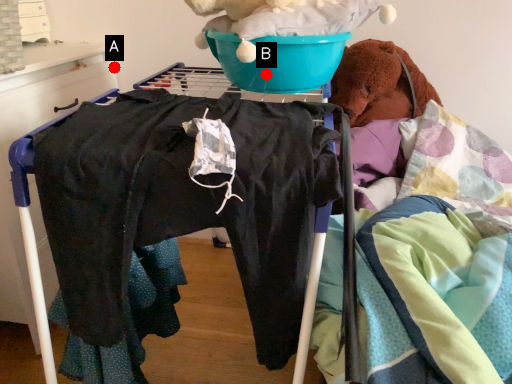
Question: Two points are circled on the image, labeled by A and B beside each circle. Among these points, which one is nearest to the camera?

Choices:
 (A) A is closer
 (B) B is closer

Answer: (B)